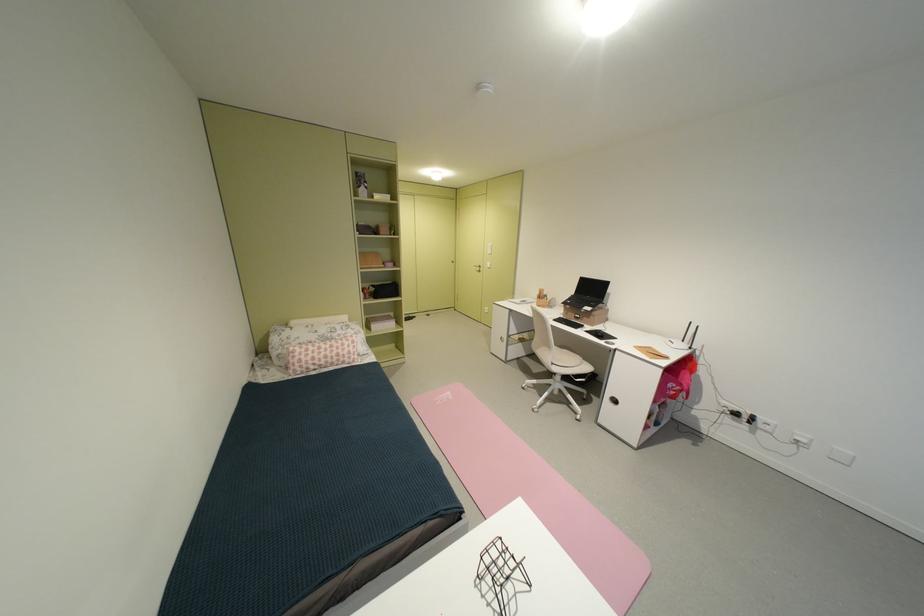
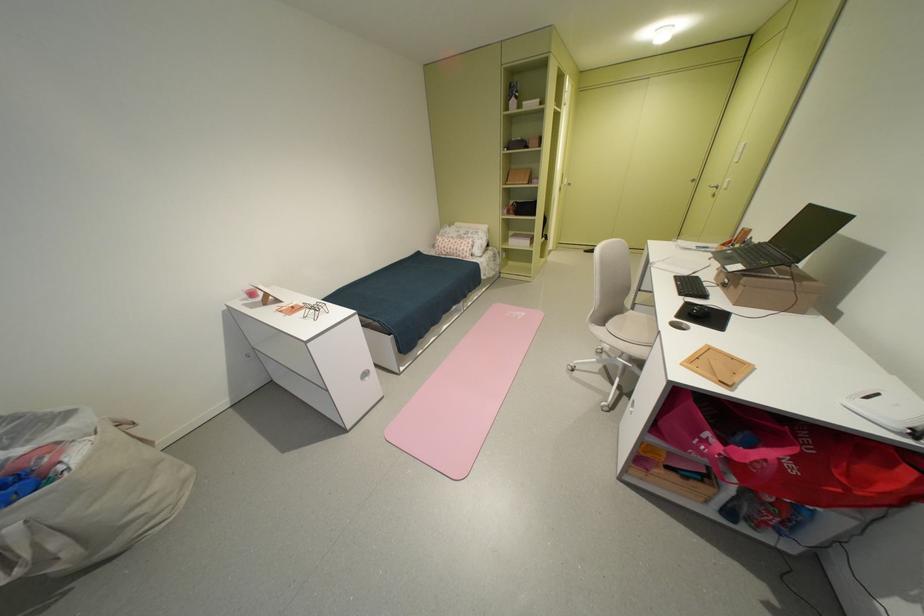
The point at (598,318) is marked in the first image. Where is the corresponding point in the second image?

(746, 288)